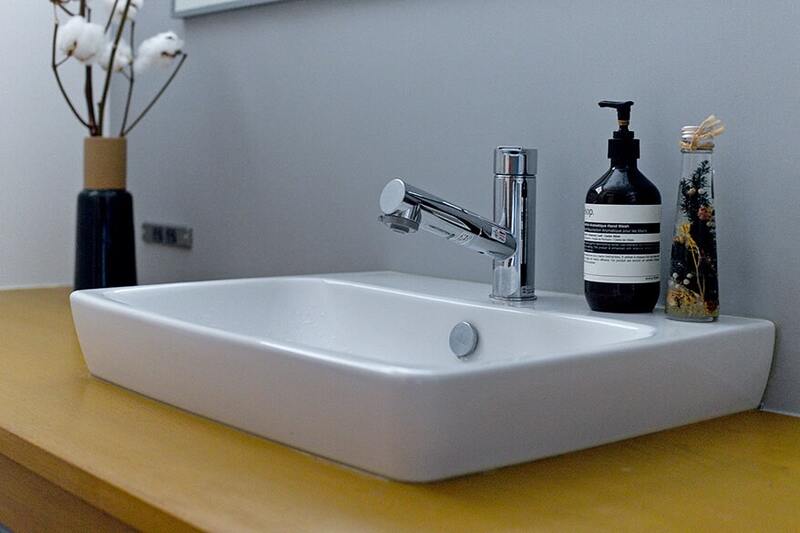
Where is `glass container`? The width and height of the screenshot is (800, 533). glass container is located at coordinates (692, 216).